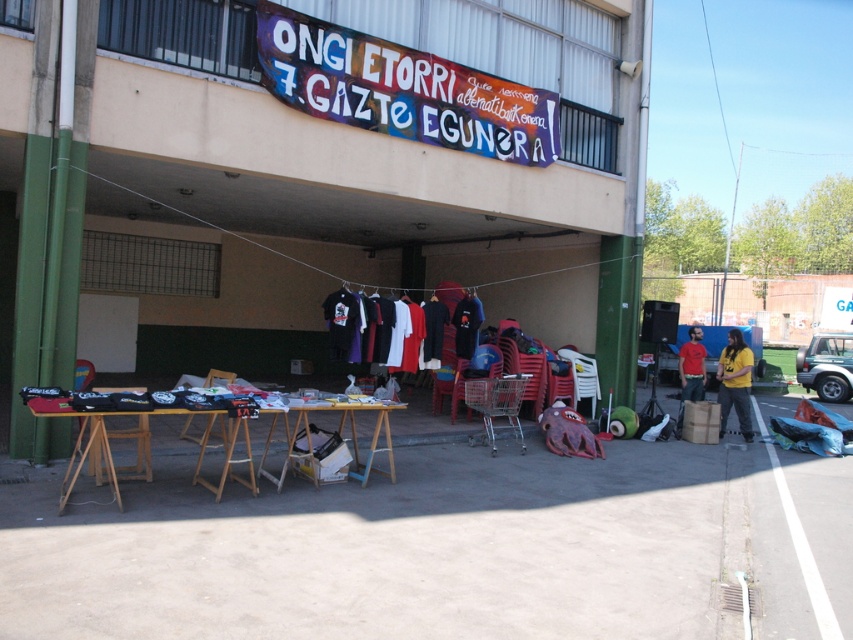
Question: Which object is the closest to the wooden table at lower center?

Choices:
 (A) yellow matte t-shirt at right
 (B) matte black t-shirts at center
 (C) wooden table at center
 (D) red matte t-shirt at right

Answer: (C)

Question: Among these points, which one is farthest from the camera?

Choices:
 (A) (289, 461)
 (B) (332, 410)
 (C) (141, 164)

Answer: (C)

Question: Estimate the real-world distances between objects in this image. Which object is closer to the yellow matte t-shirt at right?

Choices:
 (A) matte black t-shirts at center
 (B) wooden table at center

Answer: (A)

Question: Does wooden table at lower center appear on the left side of red matte t-shirt at right?

Choices:
 (A) yes
 (B) no

Answer: (A)

Question: Is the position of matte black t-shirts at center more distant than that of wooden table at lower center?

Choices:
 (A) no
 (B) yes

Answer: (B)

Question: Is yellow matte t-shirt at right to the right of red matte t-shirt at right from the viewer's perspective?

Choices:
 (A) no
 (B) yes

Answer: (B)